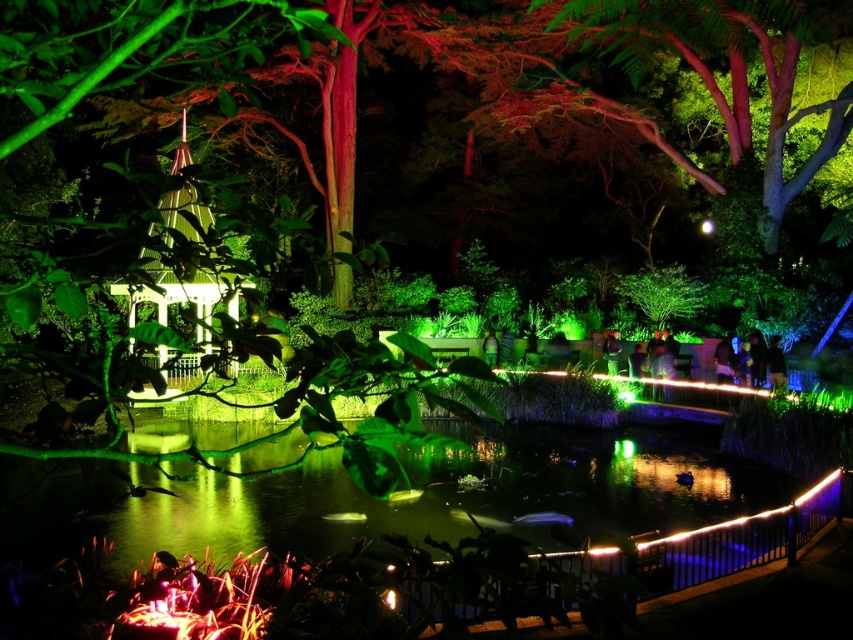
Which of these two, green reflective water at center or white glossy gazebo at left, stands shorter?

Standing shorter between the two is green reflective water at center.

Does point (224, 500) lie in front of point (161, 288)?

No, (224, 500) is behind (161, 288).

Who is more distant from viewer, [659,428] or [149,257]?

The point [659,428] is more distant.

The width and height of the screenshot is (853, 640). I want to click on green reflective water at center, so click(x=462, y=493).